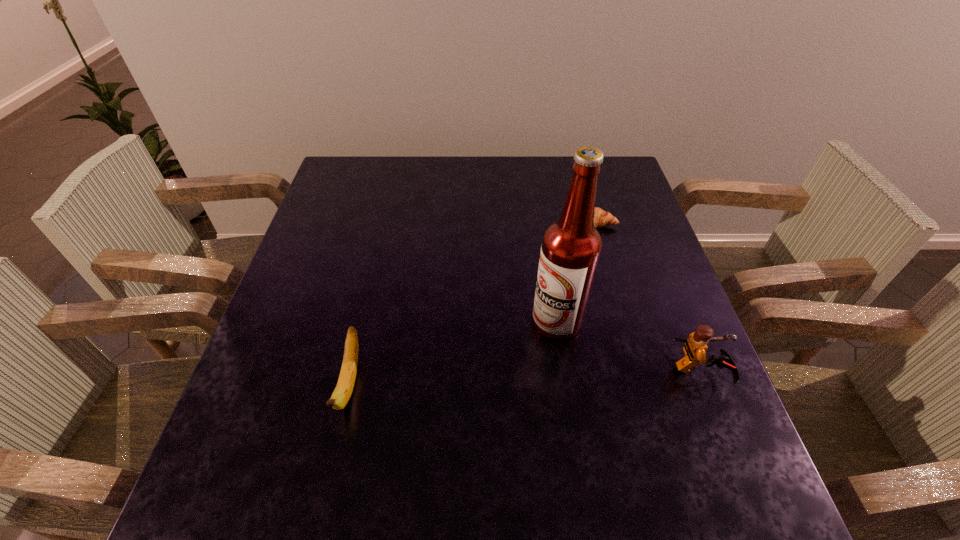
In the image, there is a desktop. Where is `free space at the right edge`? free space at the right edge is located at coordinates [x=658, y=296].

Image resolution: width=960 pixels, height=540 pixels. In the image, there is a desktop. Find the location of `vacant region at the far left corner`. vacant region at the far left corner is located at coordinates 338,160.

Identify the location of free space at the far right corner. The width and height of the screenshot is (960, 540). (634, 200).

You are a GUI agent. You are given a task and a screenshot of the screen. Output one action in this format:
    pyautogui.click(x=<x>, y=<y>)
    Task: Click on the free point between the third nearest object and the second shortest object
    This screenshot has width=960, height=540.
    Given the screenshot: What is the action you would take?
    pyautogui.click(x=453, y=353)

You are a GUI agent. You are given a task and a screenshot of the screen. Output one action in this format:
    pyautogui.click(x=<x>, y=<y>)
    Task: Click on the vacant space that's between the alcohol and the second shortest object
    This screenshot has height=540, width=960.
    Given the screenshot: What is the action you would take?
    pyautogui.click(x=453, y=353)

Identify the location of free area in between the second tallest object and the pastry. The width and height of the screenshot is (960, 540). [x=648, y=296].

Identify the location of free space between the second tallest object and the shortest object. (648, 296).

What are the coordinates of `empty location between the leftmost object and the tallest object` in the screenshot? It's located at (453, 353).

The height and width of the screenshot is (540, 960). Find the location of `the second closest object relative to the alcohol`. the second closest object relative to the alcohol is located at coordinates (601, 218).

The image size is (960, 540). I want to click on object that is the second closest to the tallest object, so click(x=601, y=218).